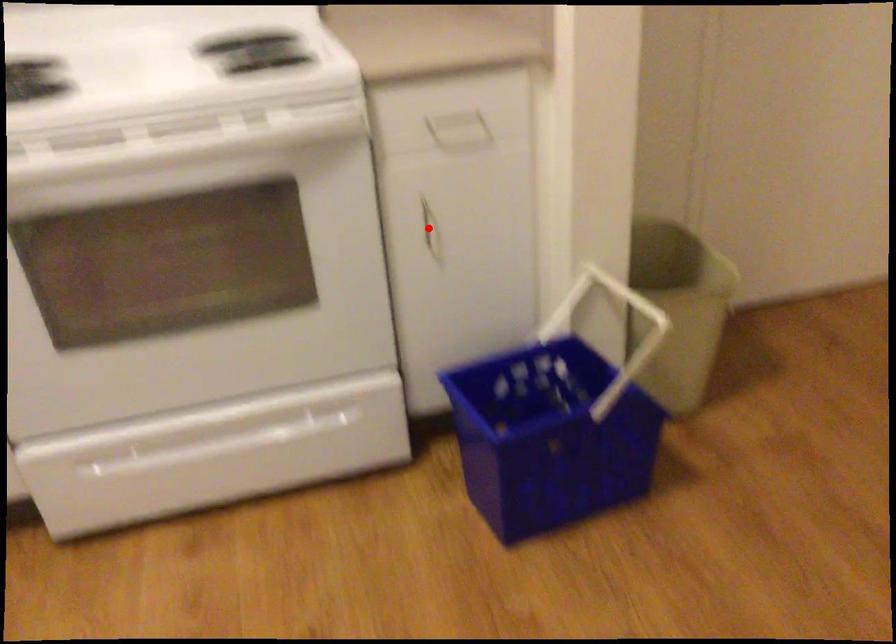
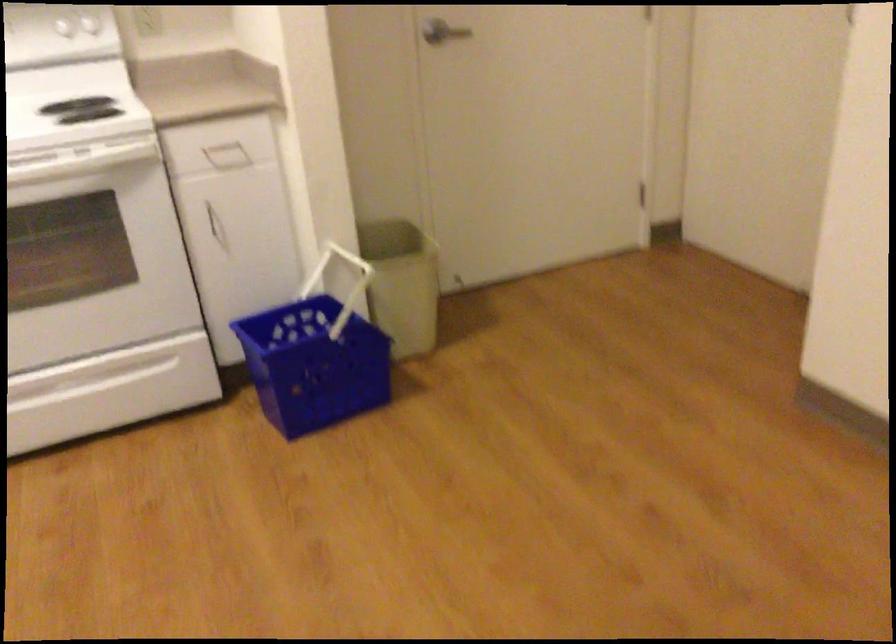
In the second image, find the point that corresponds to the highlighted location in the first image.

(216, 225)